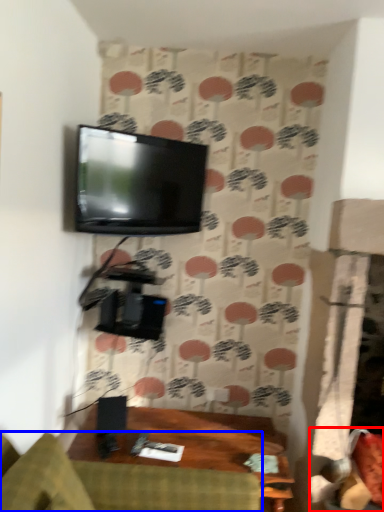
Question: Which point is closer to the camera, swivel chair (highlighted by a red box) or studio couch (highlighted by a blue box)?

Choices:
 (A) swivel chair
 (B) studio couch

Answer: (B)